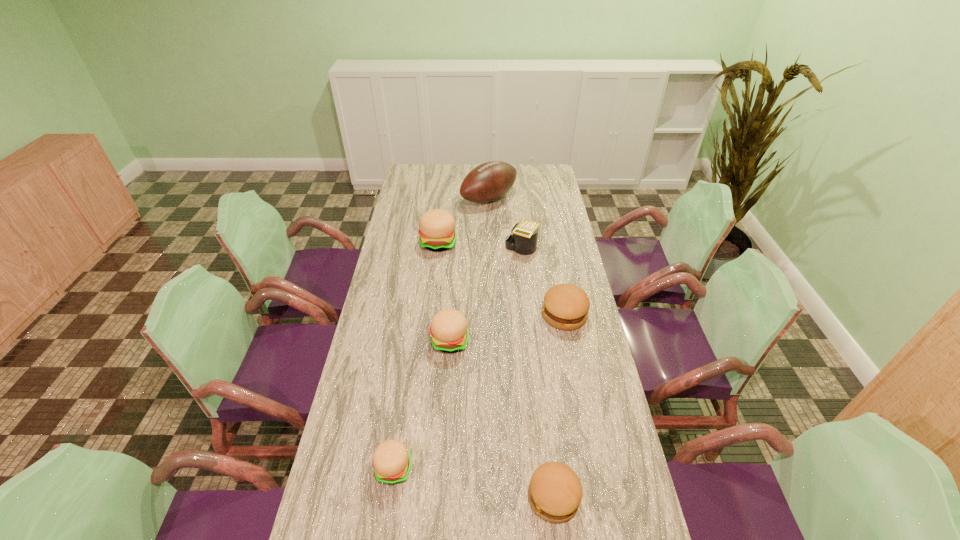
The image size is (960, 540). What are the coordinates of `free region at the right edge` in the screenshot? It's located at (540, 254).

The image size is (960, 540). I want to click on vacant space at the far right corner of the desktop, so click(529, 164).

Identify the location of free space between the nearer brown hamburger and the second farthest beige hamburger. This screenshot has height=540, width=960. (502, 419).

Where is `empty space between the second farthest beige hamburger and the nearest beige hamburger`? empty space between the second farthest beige hamburger and the nearest beige hamburger is located at coordinates (421, 405).

Identify the location of free space between the biggest beige hamburger and the calculator. This screenshot has width=960, height=540. (480, 245).

Image resolution: width=960 pixels, height=540 pixels. I want to click on free space between the second biggest beige hamburger and the calculator, so click(x=486, y=295).

The height and width of the screenshot is (540, 960). Find the location of `vacant area that lies between the farthest object and the farther brown hamburger`. vacant area that lies between the farthest object and the farther brown hamburger is located at coordinates (526, 256).

The height and width of the screenshot is (540, 960). I want to click on free spot between the second biggest beige hamburger and the nearer brown hamburger, so click(502, 419).

Select which object appears as the sixth closest to the farthest hamburger. Please provide its 2D coordinates. Your answer should be formatted as a tuple, i.e. [(x, y)], where the tuple contains the x and y coordinates of a point satisfying the conditions above.

[(555, 491)]

Locate an element on the screen. object that is the fifth closest to the second farthest beige hamburger is located at coordinates (555, 491).